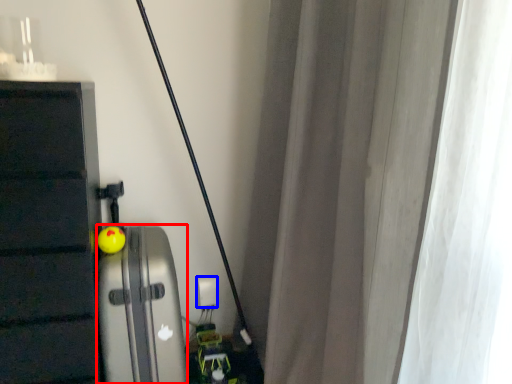
Question: Which point is closer to the camera, appliance (highlighted by a red box) or electric outlet (highlighted by a blue box)?

Choices:
 (A) appliance
 (B) electric outlet

Answer: (A)